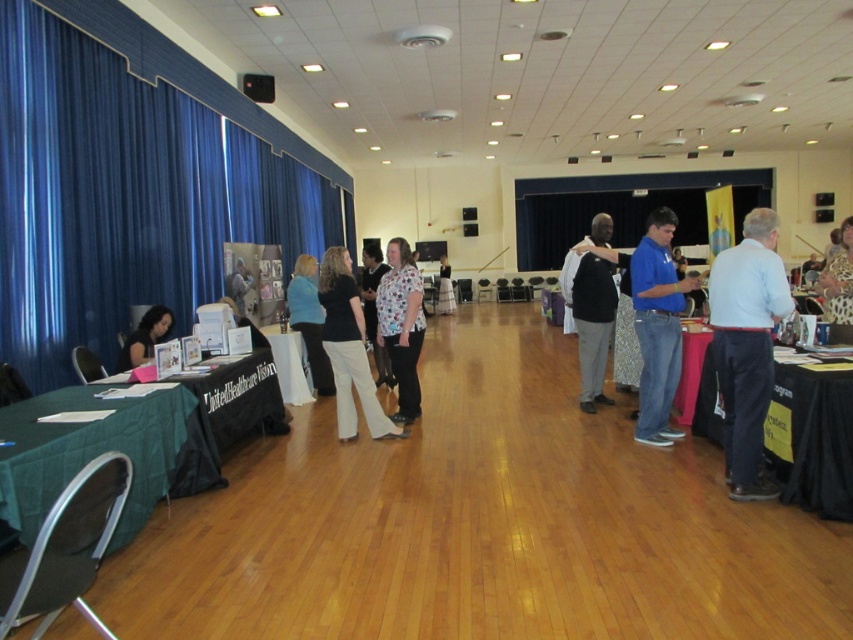
You are an event planner arranging a path for attendees to move from the entrance to the registration desk. You notice two blue items in the scene. Which blue item is closer to the entrance? The blue fabric curtain at left and the blue fabric pants at center are both in your view. Use the spatial relationship between them to determine which is closer to the entrance.

The blue fabric curtain at left is closer to the viewer than the blue fabric pants at center. Since the entrance is likely near the viewer, the blue fabric curtain at left is closer to the entrance.

You are organizing a presentation and need to set up a projector screen. The projector is placed at the right side of the room. You have two options for screen placement. The first option is to place it to the right of the blue fabric curtain at left. The second option is to place it to the left of the matte black laptop at left. Considering the room layout described, which placement would be closer to the projector?

The second option, placing the screen to the left of the matte black laptop at left, would be closer to the projector since the projector is at the right side of the room and the blue fabric curtain at left is further left than the laptop. Placing it to the left of the laptop keeps it closer to the right side where the projector is located.